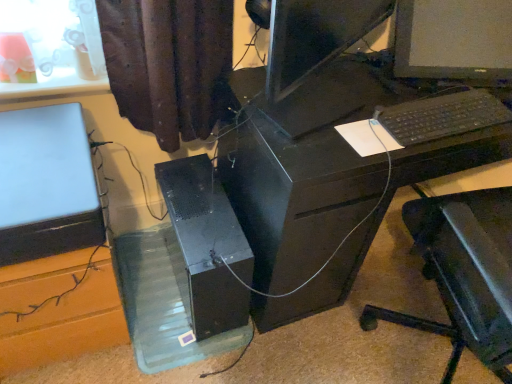
Find the location of a particular element. This screenshot has width=512, height=384. free space above black plastic desk at center (from a real-world perspective) is located at coordinates (397, 101).